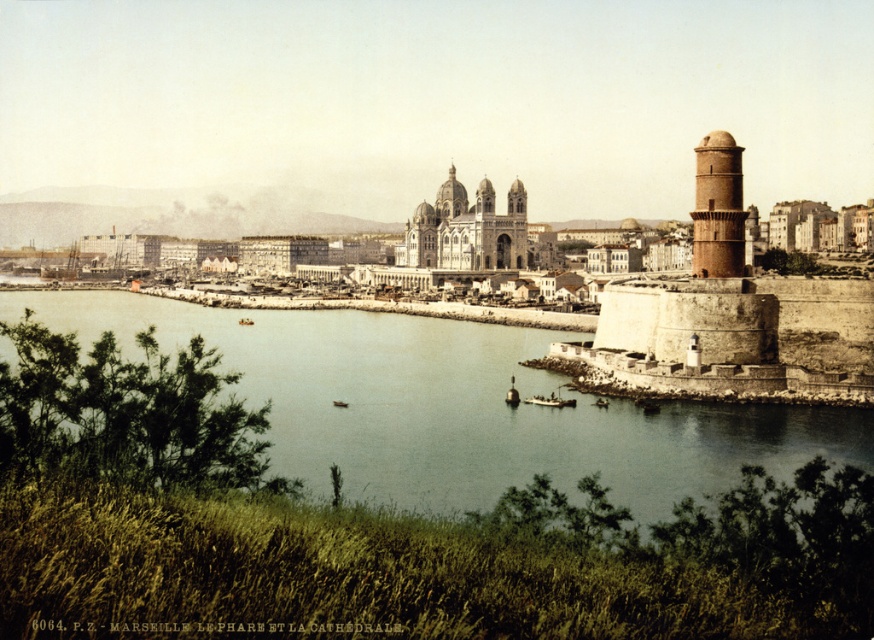
Measure the distance from greenish water at center to white stone fort at center.

63.33 meters

Which is in front, point (558, 472) or point (511, 266)?

Point (558, 472) is in front.

Image resolution: width=874 pixels, height=640 pixels. I want to click on greenish water at center, so click(454, 406).

Is greenish water at center to the right of brown textured tower at right from the viewer's perspective?

Incorrect, greenish water at center is not on the right side of brown textured tower at right.

Which is behind, point (532, 385) or point (719, 243)?

Positioned behind is point (532, 385).

This screenshot has width=874, height=640. I want to click on greenish water at center, so click(454, 406).

Is white stone fort at center further to the viewer compared to brown textured tower at right?

Yes, white stone fort at center is further from the viewer.

Is white stone fort at center to the right of brown textured tower at right from the viewer's perspective?

In fact, white stone fort at center is to the left of brown textured tower at right.

Who is more forward, [510,227] or [703,172]?

Point [703,172] is more forward.

This screenshot has height=640, width=874. I want to click on white stone fort at center, so click(466, 228).